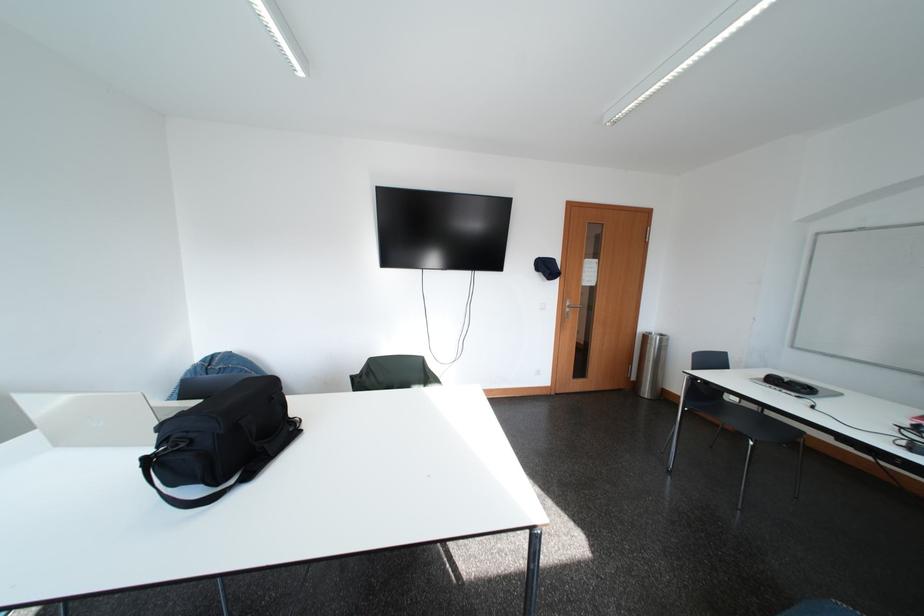
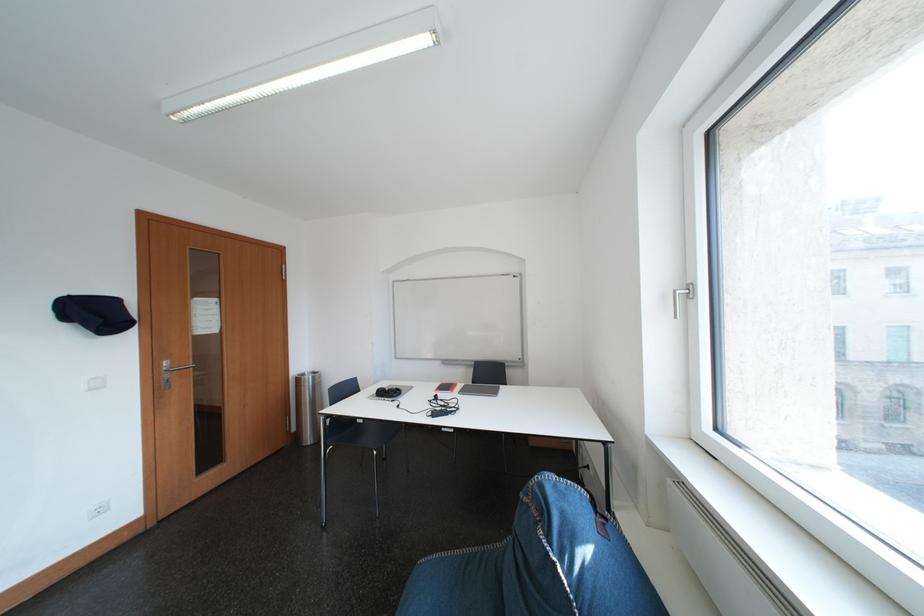
The point at (x=657, y=341) is marked in the first image. Where is the corresponding point in the second image?

(310, 383)